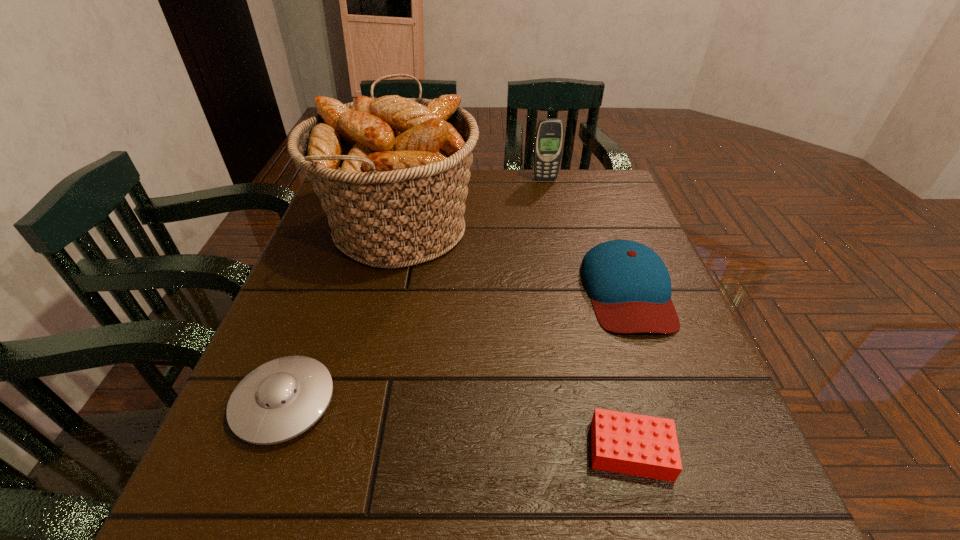
The image size is (960, 540). I want to click on blank area located on the back of the Lego, so click(x=592, y=305).

Image resolution: width=960 pixels, height=540 pixels. I want to click on basket that is at the far edge, so (391, 173).

Identify the location of cellular telephone located at the far edge. The height and width of the screenshot is (540, 960). (549, 137).

Identify the location of object at the near edge. The width and height of the screenshot is (960, 540). (639, 445).

The width and height of the screenshot is (960, 540). What are the coordinates of `basket at the left edge` in the screenshot? It's located at (391, 173).

I want to click on saucer at the left edge, so click(281, 399).

This screenshot has height=540, width=960. I want to click on baseball cap that is at the right edge, so click(630, 287).

At what (x,y) coordinates should I click in order to perform the action: click on Lego located in the right edge section of the desktop. Please return your answer as a coordinate pair (x, y). Image resolution: width=960 pixels, height=540 pixels. Looking at the image, I should click on (639, 445).

This screenshot has height=540, width=960. In order to click on object that is at the far left corner in this screenshot , I will do `click(391, 173)`.

At what (x,y) coordinates should I click in order to perform the action: click on object present at the near right corner. Please return your answer as a coordinate pair (x, y). The image size is (960, 540). Looking at the image, I should click on pyautogui.click(x=639, y=445).